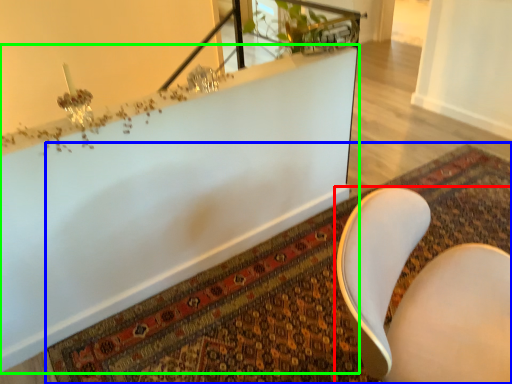
Question: Estimate the real-world distances between objects in this image. Which object is closer to chair (highlighted by a red box), mat (highlighted by a blue box) or bathtub (highlighted by a green box)?

Choices:
 (A) mat
 (B) bathtub

Answer: (A)